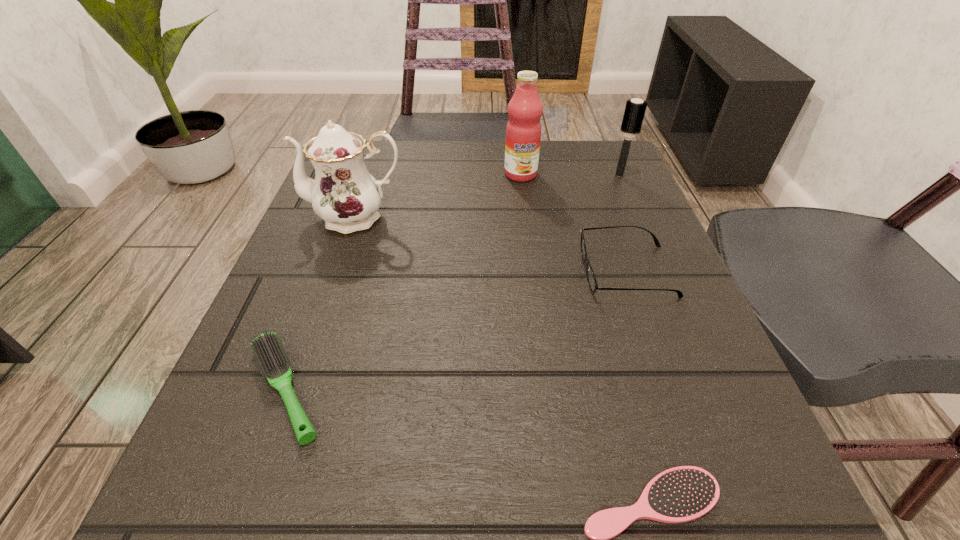
The image size is (960, 540). I want to click on the fifth closest object to the nearest object, so click(635, 109).

The width and height of the screenshot is (960, 540). Find the location of `hairbrush that can be found as the closest to the third nearest object`. hairbrush that can be found as the closest to the third nearest object is located at coordinates (635, 109).

Select which hairbrush appears as the second closest to the third nearest object. Please provide its 2D coordinates. Your answer should be formatted as a tuple, i.e. [(x, y)], where the tuple contains the x and y coordinates of a point satisfying the conditions above.

[(681, 494)]

I want to click on free spot that satisfies the following two spatial constraints: 1. on the label of the farthest hairbrush; 2. on the left side of the fruit juice, so (x=520, y=176).